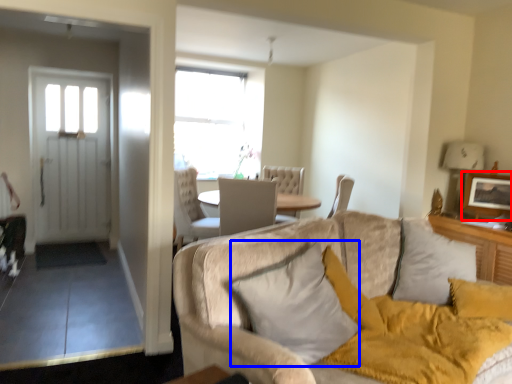
Question: Which of the following is the farthest to the observer, picture frame (highlighted by a red box) or pillow (highlighted by a blue box)?

Choices:
 (A) picture frame
 (B) pillow

Answer: (A)